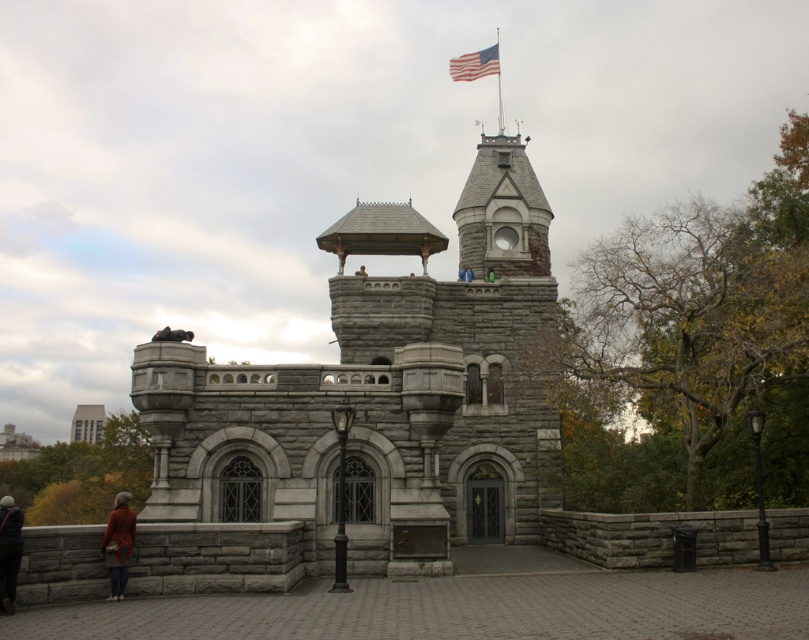
Question: Which object is positioned farthest from the orange sweater at lower left?

Choices:
 (A) american flag at upper center
 (B) brown woolen hat at lower left

Answer: (A)

Question: Estimate the real-world distances between objects in this image. Which object is farther from the orange sweater at lower left?

Choices:
 (A) gray stone tower at lower left
 (B) american flag at upper center
 (C) brown woolen hat at lower left

Answer: (A)

Question: Can you confirm if brown woolen hat at lower left is smaller than orange sweater at lower left?

Choices:
 (A) yes
 (B) no

Answer: (B)

Question: Does gray stone castle at center lie in front of brown woolen hat at lower left?

Choices:
 (A) yes
 (B) no

Answer: (B)

Question: Which object is the closest to the gray stone tower at lower left?

Choices:
 (A) american flag at upper center
 (B) brown woolen hat at lower left
 (C) orange sweater at lower left

Answer: (B)

Question: Does orange sweater at lower left have a lesser width compared to american flag at upper center?

Choices:
 (A) yes
 (B) no

Answer: (A)